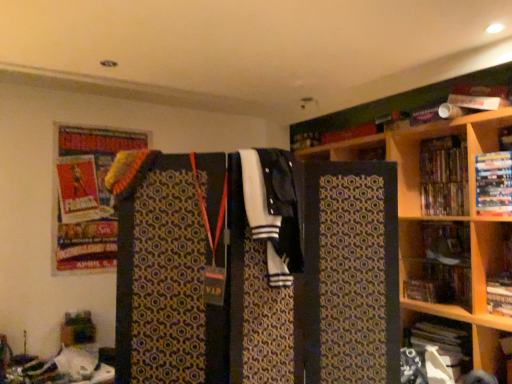
You are a GUI agent. You are given a task and a screenshot of the screen. Output one action in this format:
    pyautogui.click(x=<x>, y=<y>)
    Task: Click on the hardcover book at upper right, the 2th book positioned from the top
    The height and width of the screenshot is (384, 512).
    Given the screenshot: What is the action you would take?
    pyautogui.click(x=493, y=184)

In order to face hardcover book at right, the 2th book positioned from the bottom, should I rotate leftwards or rightwards?

It's best to rotate right around 31.340 degrees.

This screenshot has height=384, width=512. Find the location of `white paper at lower right, placed as the 1th book when sorted from bottom to top`. white paper at lower right, placed as the 1th book when sorted from bottom to top is located at coordinates (444, 344).

I want to click on hardcover book at upper right, the 2th book positioned from the top, so click(x=493, y=184).

Between hardcover book at right, the 3th book positioned from the top, and white and black fabric at center, which one appears on the left side from the viewer's perspective?

white and black fabric at center is more to the left.

From the image's perspective, who appears lower, hardcover book at right, the 3th book positioned from the top, or white and black fabric at center?

hardcover book at right, the 3th book positioned from the top, is shown below in the image.

This screenshot has width=512, height=384. In order to click on clothing lying on the left of hardcover book at right, the 2th book positioned from the bottom in this screenshot , I will do `click(274, 210)`.

Does hardcover book at upper right, which is the 1th book in top-to-bottom order, have a greater height compared to wooden bookcase at right?

In fact, hardcover book at upper right, which is the 1th book in top-to-bottom order, may be shorter than wooden bookcase at right.

Is wooden bookcase at right a part of hardcover book at upper right, which is the 1th book in top-to-bottom order?

Actually, wooden bookcase at right is outside hardcover book at upper right, which is the 1th book in top-to-bottom order.

What's the angular difference between hardcover book at upper right, which is the 4th book in bottom-to-top order, and wooden bookcase at right's facing directions?

The angular difference between hardcover book at upper right, which is the 4th book in bottom-to-top order, and wooden bookcase at right is 0.329 degrees.

From the image's perspective, between wooden bookcase at right and white paper at lower right, placed as the 1th book when sorted from bottom to top, which one is located above?

wooden bookcase at right is shown above in the image.

Is wooden bookcase at right facing towards white paper at lower right, placed as the fourth book when sorted from top to bottom?

Yes, wooden bookcase at right is turned towards white paper at lower right, placed as the fourth book when sorted from top to bottom.

How many degrees apart are the facing directions of wooden bookcase at right and white paper at lower right, placed as the 1th book when sorted from bottom to top?

The angle between the facing direction of wooden bookcase at right and the facing direction of white paper at lower right, placed as the 1th book when sorted from bottom to top, is 90 degrees.

Is there a large distance between wooden bookcase at right and white paper at lower right, placed as the fourth book when sorted from top to bottom?

wooden bookcase at right is near white paper at lower right, placed as the fourth book when sorted from top to bottom, not far away.

Between white paper at lower right, placed as the 1th book when sorted from bottom to top, and hardcover book at upper right, which is the 4th book in bottom-to-top order, which one is positioned behind?

hardcover book at upper right, which is the 4th book in bottom-to-top order, is behind.

Is white paper at lower right, placed as the fourth book when sorted from top to bottom, aimed at hardcover book at upper right, which is the 4th book in bottom-to-top order?

No, white paper at lower right, placed as the fourth book when sorted from top to bottom, is not turned towards hardcover book at upper right, which is the 4th book in bottom-to-top order.

Is white paper at lower right, placed as the fourth book when sorted from top to bottom, spatially inside hardcover book at upper right, which is the 1th book in top-to-bottom order, or outside of it?

white paper at lower right, placed as the fourth book when sorted from top to bottom, exists outside the volume of hardcover book at upper right, which is the 1th book in top-to-bottom order.

Does white paper at lower right, placed as the fourth book when sorted from top to bottom, have a greater width compared to hardcover book at upper right, which is the 4th book in bottom-to-top order?

Correct, the width of white paper at lower right, placed as the fourth book when sorted from top to bottom, exceeds that of hardcover book at upper right, which is the 4th book in bottom-to-top order.

From a real-world perspective, is hardcover book at right, the 3th book positioned from the top, beneath wooden bookshelf at right?

Yes, from a real-world perspective, hardcover book at right, the 3th book positioned from the top, is below wooden bookshelf at right.

Could you measure the distance between hardcover book at right, the 3th book positioned from the top, and wooden bookshelf at right?

hardcover book at right, the 3th book positioned from the top, and wooden bookshelf at right are 12.81 inches apart from each other.

Which point is more forward, [496,293] or [405,294]?

The point [496,293] is closer.

Is hardcover book at right, the 3th book positioned from the top, wider or thinner than wooden bookshelf at right?

Considering their sizes, hardcover book at right, the 3th book positioned from the top, looks broader than wooden bookshelf at right.

Which of these two, wooden bookshelf at right or hardcover book at upper right, the 2th book positioned from the top, is thinner?

With smaller width is wooden bookshelf at right.

From a real-world perspective, is wooden bookshelf at right over hardcover book at upper right, the third book positioned from the bottom?

Actually, wooden bookshelf at right is physically below hardcover book at upper right, the third book positioned from the bottom, in the real world.

Is wooden bookshelf at right beside hardcover book at upper right, the 2th book positioned from the top?

No, wooden bookshelf at right is not making contact with hardcover book at upper right, the 2th book positioned from the top.

Is wooden bookshelf at right facing towards hardcover book at upper right, the third book positioned from the bottom?

No, wooden bookshelf at right is not facing towards hardcover book at upper right, the third book positioned from the bottom.

Considering the relative positions of hardcover book at right, the 2th book positioned from the bottom, and hardcover book at upper right, the 2th book positioned from the top, in the image provided, is hardcover book at right, the 2th book positioned from the bottom, to the right of hardcover book at upper right, the 2th book positioned from the top, from the viewer's perspective?

Yes.

Is hardcover book at right, the 2th book positioned from the bottom, positioned with its back to hardcover book at upper right, the third book positioned from the bottom?

No, hardcover book at right, the 2th book positioned from the bottom, is not facing the opposite direction of hardcover book at upper right, the third book positioned from the bottom.

The height and width of the screenshot is (384, 512). What are the coordinates of `the 1st book below the hardcover book at upper right, the 2th book positioned from the top (from the image's perspective)` in the screenshot? It's located at (499, 296).

Starting from the white and black fabric at center, which book is the 4th one to the right? Please provide its 2D coordinates.

[(499, 296)]

The width and height of the screenshot is (512, 384). I want to click on bookcase in front of the hardcover book at upper right, which is the 4th book in bottom-to-top order, so click(436, 198).

From the image, which object appears to be farther from hardcover book at upper right, the 2th book positioned from the top, hardcover book at upper right, which is the 4th book in bottom-to-top order, or wooden bookcase at right?

The object further to hardcover book at upper right, the 2th book positioned from the top, is wooden bookcase at right.

Based on their spatial positions, is white paper at lower right, placed as the fourth book when sorted from top to bottom, or wooden bookshelf at right closer to hardcover book at upper right, which is the 4th book in bottom-to-top order?

wooden bookshelf at right.

Looking at the image, which one is located closer to wooden bookshelf at right, white paper at lower right, placed as the 1th book when sorted from bottom to top, or wooden bookcase at right?

wooden bookcase at right is closer to wooden bookshelf at right.

Based on their spatial positions, is hardcover book at upper right, which is the 4th book in bottom-to-top order, or hardcover book at upper right, the 2th book positioned from the top, further from hardcover book at right, the 2th book positioned from the bottom?

hardcover book at upper right, which is the 4th book in bottom-to-top order, is further to hardcover book at right, the 2th book positioned from the bottom.

Considering their positions, is hardcover book at right, the 3th book positioned from the top, positioned further to white and black fabric at center than wooden bookshelf at right?

hardcover book at right, the 3th book positioned from the top, lies further to white and black fabric at center than the other object.

From the image, which object appears to be farther from white paper at lower right, placed as the fourth book when sorted from top to bottom, wooden bookshelf at right or white and black fabric at center?

white and black fabric at center.

Based on their spatial positions, is wooden bookcase at right or hardcover book at upper right, the 2th book positioned from the top, further from white paper at lower right, placed as the 1th book when sorted from bottom to top?

Based on the image, hardcover book at upper right, the 2th book positioned from the top, appears to be further to white paper at lower right, placed as the 1th book when sorted from bottom to top.

Looking at the image, which one is located closer to wooden bookcase at right, wooden bookshelf at right or hardcover book at right, the 2th book positioned from the bottom?

wooden bookshelf at right.

This screenshot has width=512, height=384. What are the coordinates of `book between hardcover book at upper right, which is the 4th book in bottom-to-top order, and hardcover book at right, the 3th book positioned from the top, vertically` in the screenshot? It's located at (493, 184).

Locate an element on the screen. The image size is (512, 384). bookcase between white and black fabric at center and wooden bookshelf at right in the horizontal direction is located at coordinates (436, 198).

Where is `shelf located between white and black fabric at center and hardcover book at right, the 2th book positioned from the bottom, in the left-right direction`? The width and height of the screenshot is (512, 384). shelf located between white and black fabric at center and hardcover book at right, the 2th book positioned from the bottom, in the left-right direction is located at coordinates (437, 262).

Identify the location of book between hardcover book at upper right, which is the 1th book in top-to-bottom order, and wooden bookcase at right, in the vertical direction. This screenshot has width=512, height=384. (493, 184).